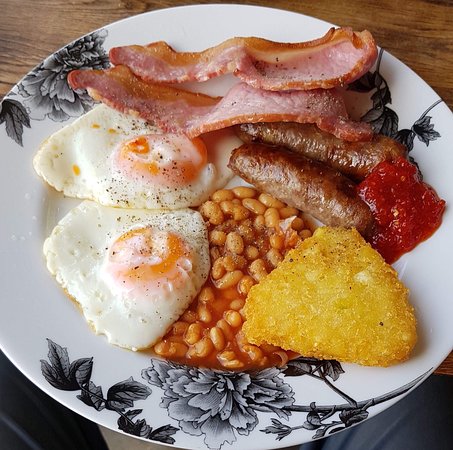
Find the location of a particular element. This screenshot has height=450, width=453. white sections of plate is located at coordinates (24, 169), (29, 274), (438, 293), (227, 23).